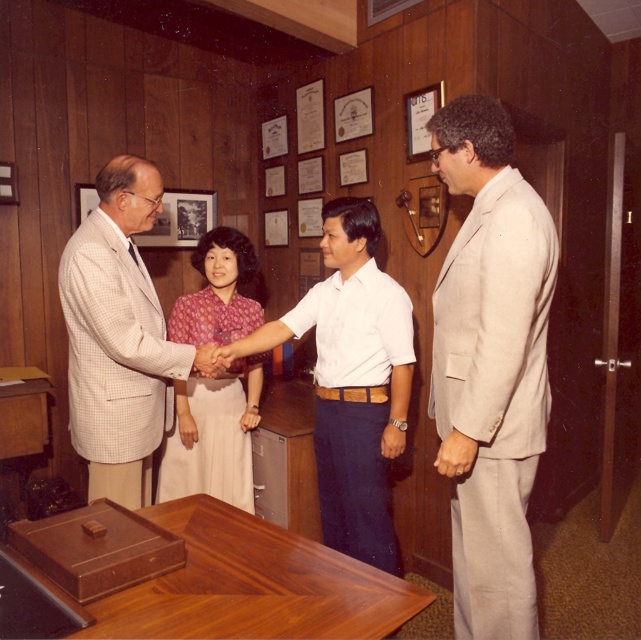
You are an observer in the office scene. You notice the white cotton shirt at center and the light beige checkered suit at left. Which clothing item appears bigger in the image?

The white cotton shirt at center appears larger than the light beige checkered suit at left in the image.

You are an interior designer observing the office scene. You need to place a 1.2 meter wide decorative panel between the light beige checkered suit at left and the matte pink blouse at center. Will there be enough space?

The light beige checkered suit at left might be wider than matte pink blouse at center, so the distance between them is uncertain. Without knowing the exact width of the suit and blouse, it is impossible to determine if the 1.2 meter panel will fit.

You are a photographer positioned at the back of the room. You want to take a photo of the matte pink blouse at center and the matte skin hand at center such that both are in focus. Given that your camera has a depth of field that can sharply focus on objects within 15 inches of each other, will both objects be in focus?

The matte pink blouse at center and the matte skin hand at center are 15.84 inches apart. Since the distance between them exceeds the camera s 15 inch depth of field range, both objects might not be in focus simultaneously.